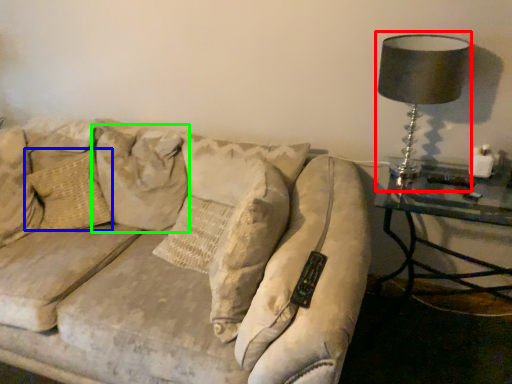
Question: Which is nearer to the table lamp (highlighted by a red box)? pillow (highlighted by a blue box) or pillow (highlighted by a green box).

Choices:
 (A) pillow
 (B) pillow

Answer: (B)